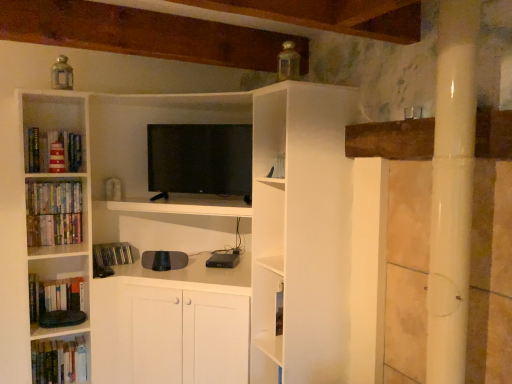
Find the location of a particular element. This screenshot has height=384, width=512. free point above hardcover books at left, which is counted as the 5th book, starting from the bottom (from a real-world perspective) is located at coordinates (47, 183).